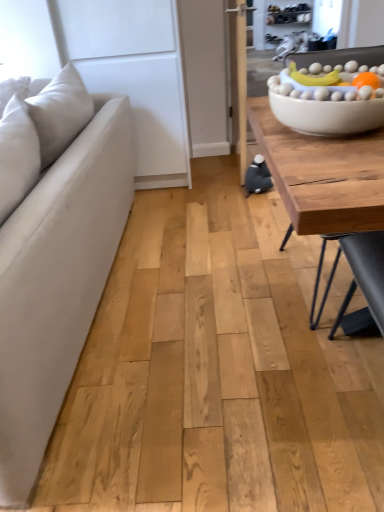
Question: From their relative heights in the image, would you say suede beige couch at left is taller or shorter than wooden table at right?

Choices:
 (A) tall
 (B) short

Answer: (A)

Question: From the image's perspective, relative to wooden table at right, is suede beige couch at left above or below?

Choices:
 (A) above
 (B) below

Answer: (B)

Question: Which object is positioned farthest from the white matte bowl at upper right?

Choices:
 (A) wooden table at right
 (B) suede beige couch at left

Answer: (B)

Question: Estimate the real-world distances between objects in this image. Which object is closer to the white matte bowl at upper right?

Choices:
 (A) suede beige couch at left
 (B) wooden table at right

Answer: (B)